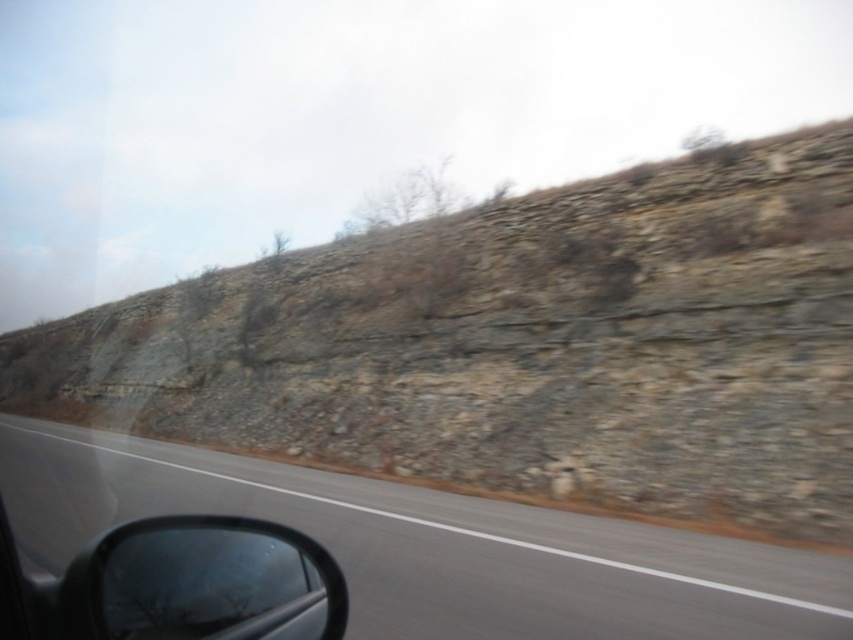
Is rocky terrain at upper right positioned before black matte side mirror at lower left?

No, rocky terrain at upper right is behind black matte side mirror at lower left.

Does rocky terrain at upper right appear on the right side of black matte side mirror at lower left?

Incorrect, rocky terrain at upper right is not on the right side of black matte side mirror at lower left.

Is point (444, 339) positioned in front of point (78, 573)?

No, it is behind (78, 573).

Find the location of a particular element. rocky terrain at upper right is located at coordinates (521, 346).

Which is in front, point (497, 326) or point (695, 586)?

Point (695, 586) is more forward.

Between rocky terrain at upper right and gray asphalt road at lower left, which one has more height?

With more height is rocky terrain at upper right.

This screenshot has height=640, width=853. Identify the location of rocky terrain at upper right. (521, 346).

Where is `rocky terrain at upper right`? rocky terrain at upper right is located at coordinates (521, 346).

Between point (573, 524) and point (294, 529), which one is positioned behind?

The point (573, 524) is more distant.

Between gray asphalt road at lower left and black matte side mirror at lower left, which one has less height?

black matte side mirror at lower left

Where is `gray asphalt road at lower left`? This screenshot has height=640, width=853. gray asphalt road at lower left is located at coordinates (434, 547).